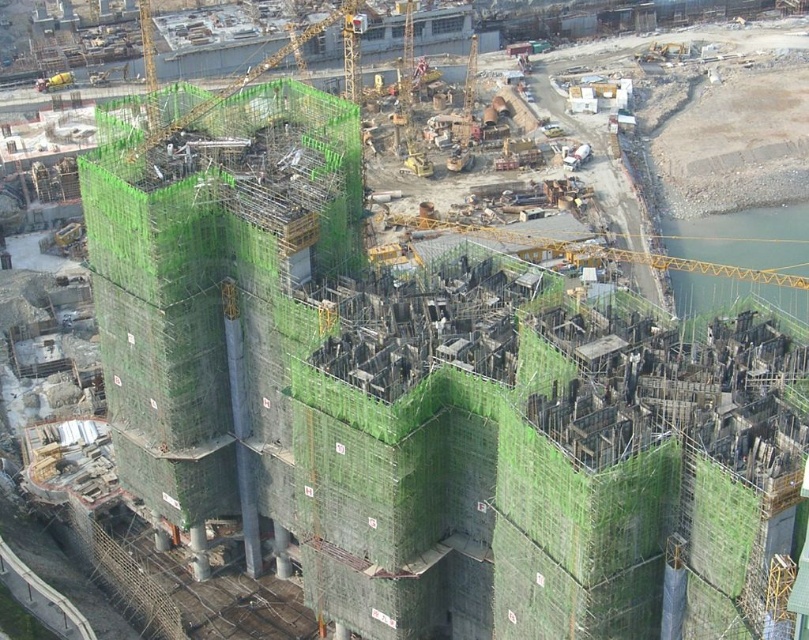
You are an inspector evaluating the construction site. You notice the green netting at center and the green mesh scaffolding at upper center. Which of these two items is shorter in height?

The green netting at center is shorter in height compared to the green mesh scaffolding at upper center.

You are an engineer assessing the construction site. You need to determine if there is enough space to move the yellow metal crane at upper right to the location currently occupied by the green mesh scaffolding at upper center. Based on the spatial relationship between these objects, can the crane be moved there?

The yellow metal crane at upper right occupies less space than the green mesh scaffolding at upper center. Therefore, the crane can be moved to the location of the green mesh scaffolding at upper center since it requires less space.

You are an inspector at the construction site. You need to determine if the green netting at center can block the view of the yellow metal crane at upper right from your current position. Can it?

The green netting at center is taller than the yellow metal crane at upper right, so it can block the view of the yellow metal crane at upper right.